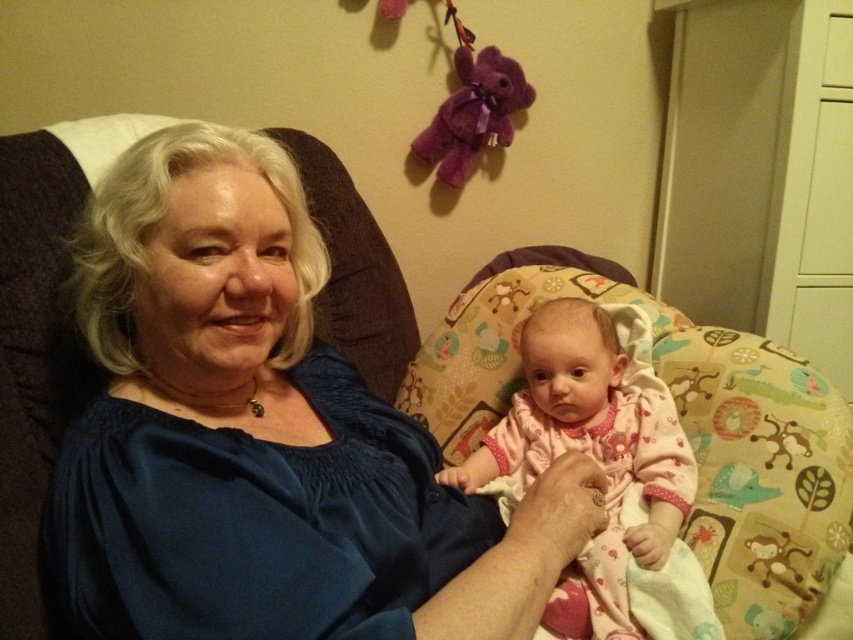
Does blue satin blouse at upper left appear over pink fabric baby at center?

Yes, blue satin blouse at upper left is above pink fabric baby at center.

Does point (337, 406) come in front of point (575, 600)?

No, it is not.

Find the location of a particular element. The width and height of the screenshot is (853, 640). blue satin blouse at upper left is located at coordinates 260,436.